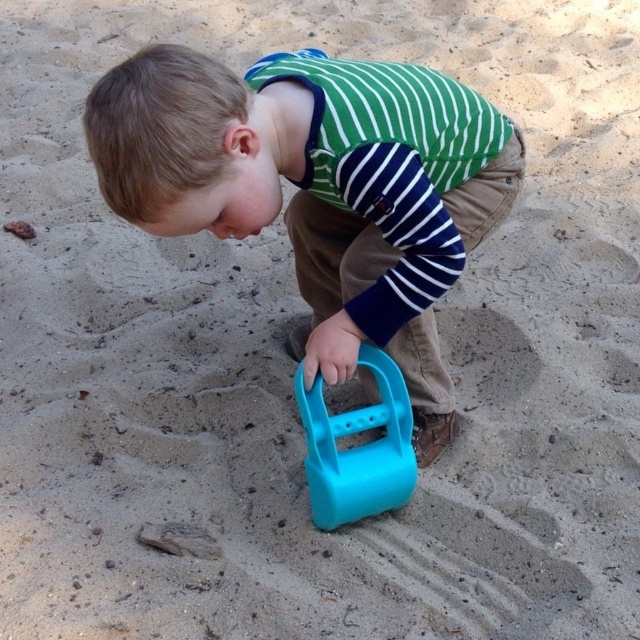
You are a parent trying to choose a shovel for your child to use at the beach. The child prefers smaller tools. Which shovel between the matte plastic shovel at center and the blue plastic shovel at center would you choose?

The blue plastic shovel at center is smaller in size than the matte plastic shovel at center, so you should choose the blue plastic shovel at center for the child.

You are helping a child choose between two shovels at the beach. The matte plastic shovel at center and the blue plastic shovel at center. Which shovel is wider?

The matte plastic shovel at center is wider than the blue plastic shovel at center.